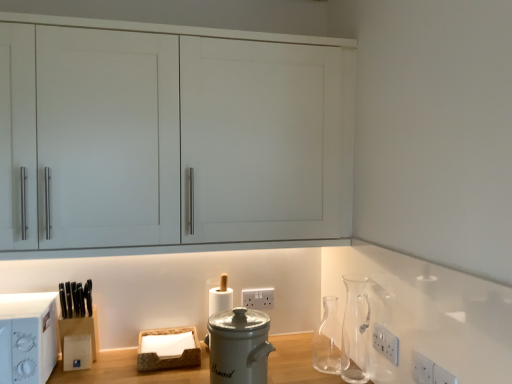
This screenshot has height=384, width=512. In order to click on white plastic electric outlet at lower right, placed as the 4th electric outlet when sorted from back to front in this screenshot , I will do `click(443, 376)`.

This screenshot has width=512, height=384. Identify the location of white plastic electrical outlet at lower right, arranged as the 3th electric outlet when viewed from the right. (385, 343).

Describe the element at coordinates (170, 137) in the screenshot. I see `white matte cabinet at upper center` at that location.

The image size is (512, 384). Find the location of `white matte cabinet at upper center`. white matte cabinet at upper center is located at coordinates (170, 137).

Identify the location of transparent glass carafe at right. (355, 331).

Describe the element at coordinates (239, 346) in the screenshot. Image resolution: width=512 pixels, height=384 pixels. I see `white ceramic bread bin at center` at that location.

Locate an element on the screen. transparent glass carafe at center-right is located at coordinates (328, 339).

This screenshot has height=384, width=512. Find the location of `white plastic microwave at left`. white plastic microwave at left is located at coordinates (27, 337).

This screenshot has height=384, width=512. I want to click on white plastic electric outlet at lower right, placed as the 3th electric outlet when sorted from back to front, so click(x=422, y=368).

Is brown woven basket at lower center smaller than white matte cabinet at upper center?

Correct, brown woven basket at lower center occupies less space than white matte cabinet at upper center.

From the image's perspective, relative to white matte cabinet at upper center, is brown woven basket at lower center above or below?

Based on their image positions, brown woven basket at lower center is located beneath white matte cabinet at upper center.

Which object is closer to the camera, brown woven basket at lower center or white matte cabinet at upper center?

white matte cabinet at upper center.

Can we say white ceramic bread bin at center lies outside transparent glass carafe at right?

Yes, white ceramic bread bin at center is outside of transparent glass carafe at right.

Which point is more forward, (260, 312) or (358, 366)?

Positioned in front is point (260, 312).

Based on their sizes in the image, would you say white ceramic bread bin at center is bigger or smaller than transparent glass carafe at right?

Clearly, white ceramic bread bin at center is larger in size than transparent glass carafe at right.

Find the location of a particular element. The width and height of the screenshot is (512, 384). kitchen appliance on the left of the transparent glass carafe at right is located at coordinates (239, 346).

Between point (174, 367) and point (422, 363), which one is positioned behind?

Positioned behind is point (174, 367).

From the picture: From the image's perspective, would you say brown woven basket at lower center is shown under white plastic electric outlet at lower right, placed as the 3th electric outlet when sorted from back to front?

Indeed, from the image's perspective, brown woven basket at lower center is shown beneath white plastic electric outlet at lower right, placed as the 3th electric outlet when sorted from back to front.

Considering the sizes of brown woven basket at lower center and white plastic electric outlet at lower right, the second electric outlet from the front, in the image, is brown woven basket at lower center taller or shorter than white plastic electric outlet at lower right, the second electric outlet from the front,?

Considering their sizes, brown woven basket at lower center has more height than white plastic electric outlet at lower right, the second electric outlet from the front.

Are brown woven basket at lower center and white plastic electric outlet at lower right, the second electric outlet from the front, beside each other?

brown woven basket at lower center is not next to white plastic electric outlet at lower right, the second electric outlet from the front, and they're not touching.

Does white plastic electric outlet at lower center, acting as the 1th electric outlet starting from the back, have a greater width compared to white plastic electric outlet at lower right, the second electric outlet from the front?

Yes, white plastic electric outlet at lower center, acting as the 1th electric outlet starting from the back, is wider than white plastic electric outlet at lower right, the second electric outlet from the front.

Which electric outlet is the 2nd one when counting from the front of the white plastic electric outlet at lower center, acting as the 1th electric outlet starting from the back? Please provide its 2D coordinates.

[(422, 368)]

From a real-world perspective, which object stands above the other?

white plastic electric outlet at lower center, acting as the 1th electric outlet starting from the back.

Which is closer, (243,300) or (429,359)?

Point (243,300).

Between transparent glass carafe at right and transparent glass carafe at center-right, which one has less height?

transparent glass carafe at center-right is shorter.

Measure the distance from transparent glass carafe at right to transparent glass carafe at center-right.

transparent glass carafe at right is 4.15 inches away from transparent glass carafe at center-right.

The image size is (512, 384). Identify the location of glass vase below the transparent glass carafe at right (from a real-world perspective). (328, 339).

Considering the sizes of objects transparent glass carafe at right and transparent glass carafe at center-right in the image provided, who is bigger, transparent glass carafe at right or transparent glass carafe at center-right?

Bigger between the two is transparent glass carafe at right.

Which object is closer to the camera taking this photo, white plastic electric outlet at lower right, which is the 4th electric outlet in left-to-right order, or transparent glass carafe at center-right?

white plastic electric outlet at lower right, which is the 4th electric outlet in left-to-right order, is in front.

Does white plastic electric outlet at lower right, placed as the 4th electric outlet when sorted from back to front, touch transparent glass carafe at center-right?

white plastic electric outlet at lower right, placed as the 4th electric outlet when sorted from back to front, and transparent glass carafe at center-right are clearly separated.

Is white plastic electric outlet at lower right, which is the 4th electric outlet in left-to-right order, bigger than transparent glass carafe at center-right?

Actually, white plastic electric outlet at lower right, which is the 4th electric outlet in left-to-right order, might be smaller than transparent glass carafe at center-right.

Is white matte cabinet at upper center positioned with its back to white plastic electric outlet at lower right, the second electric outlet from the front?

No, white matte cabinet at upper center is not facing the opposite direction of white plastic electric outlet at lower right, the second electric outlet from the front.

In the image, is white matte cabinet at upper center on the left side or the right side of white plastic electric outlet at lower right, the 3th electric outlet from the left?

From the image, it's evident that white matte cabinet at upper center is to the left of white plastic electric outlet at lower right, the 3th electric outlet from the left.

Image resolution: width=512 pixels, height=384 pixels. I want to click on cabinetry that appears above the white plastic electric outlet at lower right, the 2th electric outlet from the right (from a real-world perspective), so click(x=170, y=137).

Between white matte cabinet at upper center and white plastic electric outlet at lower right, placed as the 3th electric outlet when sorted from back to front, which one has smaller width?

white plastic electric outlet at lower right, placed as the 3th electric outlet when sorted from back to front, is thinner.

Find the location of a particular element. Image resolution: width=512 pixels, height=384 pixels. basket located underneath the white matte cabinet at upper center (from a real-world perspective) is located at coordinates (169, 355).

Image resolution: width=512 pixels, height=384 pixels. I want to click on kitchen appliance below the transparent glass carafe at right (from the image's perspective), so click(239, 346).

Considering their positions, is white ceramic bread bin at center positioned further to white plastic electric outlet at lower center, acting as the 1th electric outlet starting from the back, than transparent glass carafe at right?

The object further to white plastic electric outlet at lower center, acting as the 1th electric outlet starting from the back, is white ceramic bread bin at center.

From the image, which object appears to be nearer to brown woven basket at lower center, transparent glass carafe at right or white plastic electric outlet at lower center, acting as the fourth electric outlet starting from the right?

white plastic electric outlet at lower center, acting as the fourth electric outlet starting from the right, is closer to brown woven basket at lower center.

Based on their spatial positions, is white plastic electric outlet at lower right, the 3th electric outlet from the left, or brown woven basket at lower center further from white ceramic bread bin at center?

white plastic electric outlet at lower right, the 3th electric outlet from the left.

Considering their positions, is transparent glass carafe at right positioned further to white plastic microwave at left than brown woven basket at lower center?

transparent glass carafe at right is positioned further to the anchor white plastic microwave at left.

From the image, which object appears to be farther from transparent glass carafe at right, white matte cabinet at upper center or white plastic electric outlet at lower center, the 1th electric outlet viewed from the left?

white matte cabinet at upper center.

Based on their spatial positions, is white plastic electric outlet at lower right, placed as the 3th electric outlet when sorted from back to front, or white ceramic bread bin at center further from white matte cabinet at upper center?

white plastic electric outlet at lower right, placed as the 3th electric outlet when sorted from back to front, lies further to white matte cabinet at upper center than the other object.

Considering their positions, is brown woven basket at lower center positioned further to transparent glass carafe at center-right than white plastic microwave at left?

The object further to transparent glass carafe at center-right is white plastic microwave at left.

When comparing their distances from white matte cabinet at upper center, does transparent glass carafe at right or white plastic electrical outlet at lower right, the third electric outlet from the front, seem closer?

Among the two, transparent glass carafe at right is located nearer to white matte cabinet at upper center.

Find the location of `kitchen appliance between white matte cabinet at upper center and white plastic electric outlet at lower right, acting as the 1th electric outlet starting from the right`. kitchen appliance between white matte cabinet at upper center and white plastic electric outlet at lower right, acting as the 1th electric outlet starting from the right is located at coordinates tap(239, 346).

Where is `electric outlet between brown woven basket at lower center and transparent glass carafe at right in the horizontal direction`? electric outlet between brown woven basket at lower center and transparent glass carafe at right in the horizontal direction is located at coordinates (258, 298).

You are a GUI agent. You are given a task and a screenshot of the screen. Output one action in this format:
    pyautogui.click(x=<x>, y=<y>)
    Task: Click on the kitchen appliance between white plastic microwave at left and white plastic electrical outlet at lower right, the second electric outlet viewed from the back, from left to right
    
    Given the screenshot: What is the action you would take?
    pyautogui.click(x=239, y=346)

Locate an element on the screen. glass vase positioned between white plastic electric outlet at lower right, placed as the 4th electric outlet when sorted from back to front, and white plastic electric outlet at lower center, arranged as the fourth electric outlet when viewed from the front, from near to far is located at coordinates (328, 339).